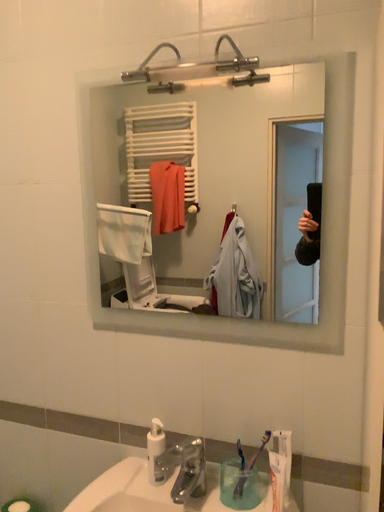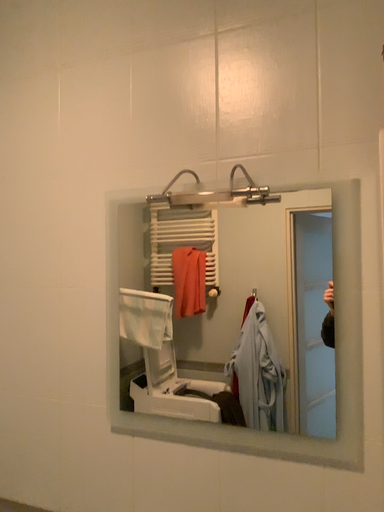
Question: How did the camera likely rotate when shooting the video?

Choices:
 (A) rotated downward
 (B) rotated upward

Answer: (B)